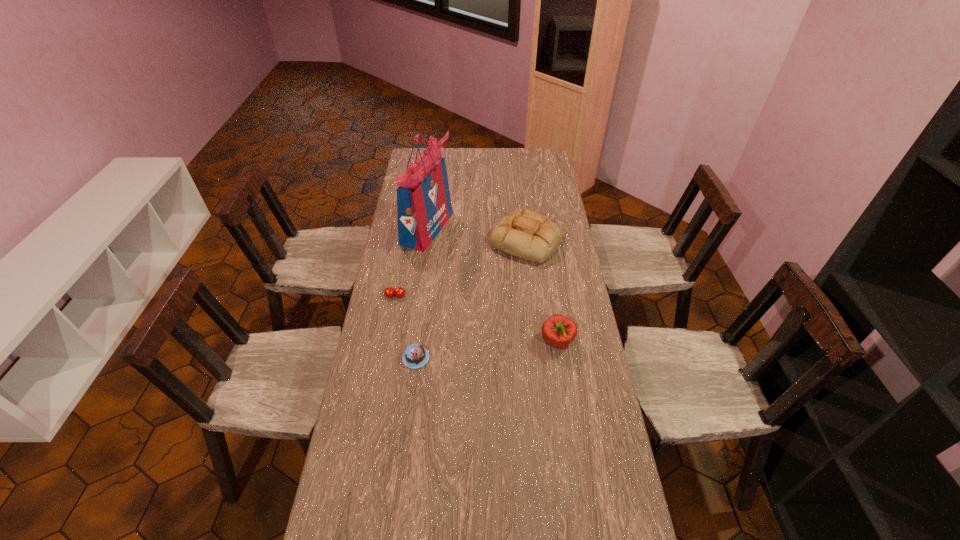
In order to click on free location that satisfies the following two spatial constraints: 1. on the front-facing side of the shortest object; 2. on the left side of the grocery bag in this screenshot , I will do click(x=410, y=358).

This screenshot has width=960, height=540. Find the location of `blank space that satisfies the following two spatial constraints: 1. on the front-facing side of the grocery bag; 2. with the stems of the cherry pointing upwards`. blank space that satisfies the following two spatial constraints: 1. on the front-facing side of the grocery bag; 2. with the stems of the cherry pointing upwards is located at coordinates (419, 296).

You are a GUI agent. You are given a task and a screenshot of the screen. Output one action in this format:
    pyautogui.click(x=<x>, y=<y>)
    Task: Click on the vacant space that satisfies the following two spatial constraints: 1. with the stems of the chocolate cake pointing upwards; 2. on the right side of the third farthest object
    
    Given the screenshot: What is the action you would take?
    384,358

At what (x,y) coordinates should I click in order to perform the action: click on vacant space that satisfies the following two spatial constraints: 1. on the front-facing side of the shortest object; 2. on the right side of the grocery bag. Please return your answer as a coordinate pair (x, y). The width and height of the screenshot is (960, 540). Looking at the image, I should click on (410, 358).

At what (x,y) coordinates should I click in order to perform the action: click on free spot that satisfies the following two spatial constraints: 1. on the front-facing side of the bell pepper; 2. on the right side of the grocery bag. Please return your answer as a coordinate pair (x, y). Looking at the image, I should click on (412, 342).